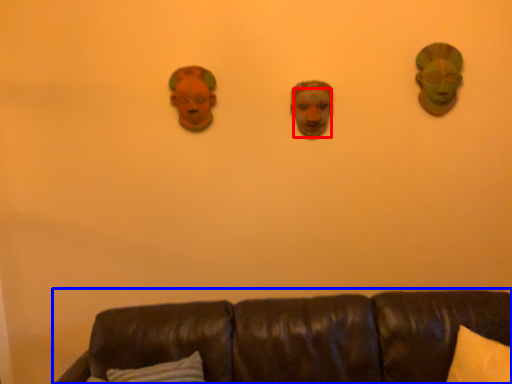
Question: Among these objects, which one is farthest to the camera, human face (highlighted by a red box) or studio couch (highlighted by a blue box)?

Choices:
 (A) human face
 (B) studio couch

Answer: (A)